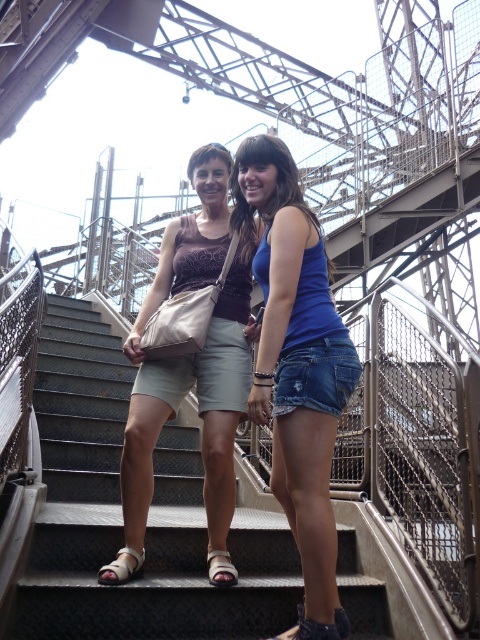
Can you confirm if blue denim shorts at center is thinner than matte beige shorts at center?

Correct, blue denim shorts at center's width is less than matte beige shorts at center's.

Is blue denim shorts at center to the right of matte beige shorts at center from the viewer's perspective?

Correct, you'll find blue denim shorts at center to the right of matte beige shorts at center.

Is point (295, 420) more distant than point (208, 564)?

No.

Where is `blue denim shorts at center`? The width and height of the screenshot is (480, 640). blue denim shorts at center is located at coordinates (297, 365).

Is metal stairs at center wider than blue denim shorts at center?

Yes.

Is metal stairs at center taller than blue denim shorts at center?

No.

Consider the image. Who is more forward, [177,636] or [264,298]?

Point [177,636]

The width and height of the screenshot is (480, 640). I want to click on metal stairs at center, so click(120, 513).

Looking at this image, who is more forward, (104, 426) or (132, 534)?

Point (132, 534) is more forward.

Between metal stairs at center and matte beige shorts at center, which one is positioned lower?

Positioned lower is metal stairs at center.

Locate an element on the screen. This screenshot has height=640, width=480. metal stairs at center is located at coordinates (120, 513).